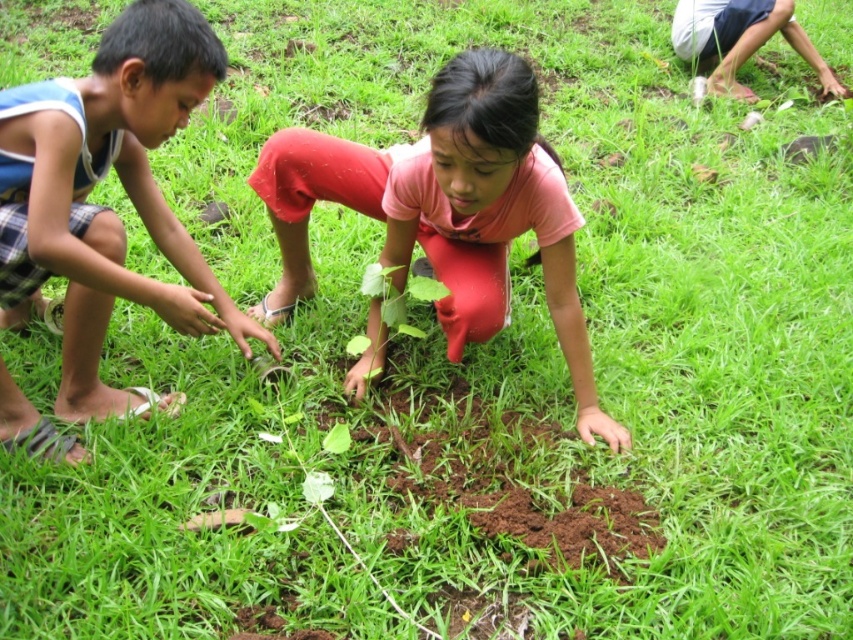
Question: Is blue plaid shorts at left thinner than pink matte shirt at center?

Choices:
 (A) yes
 (B) no

Answer: (A)

Question: Does blue plaid shorts at left have a greater width compared to pink matte shirt at center?

Choices:
 (A) yes
 (B) no

Answer: (B)

Question: Which point is farther from the camera taking this photo?

Choices:
 (A) (523, 125)
 (B) (173, 248)

Answer: (B)

Question: Is blue plaid shorts at left to the left of pink matte shirt at center from the viewer's perspective?

Choices:
 (A) yes
 (B) no

Answer: (A)

Question: Which point is farther to the camera?

Choices:
 (A) (64, 355)
 (B) (466, 282)

Answer: (B)